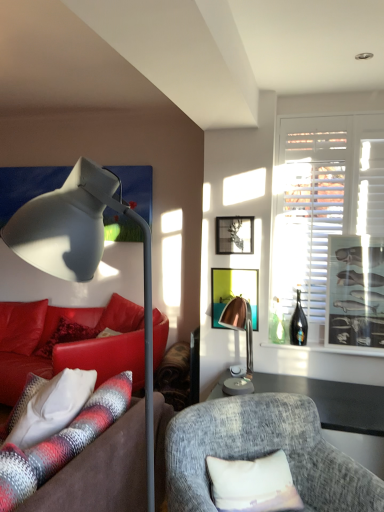
Where is `empty space that is ontop of white matte window at right`? This screenshot has height=512, width=384. empty space that is ontop of white matte window at right is located at coordinates 338,104.